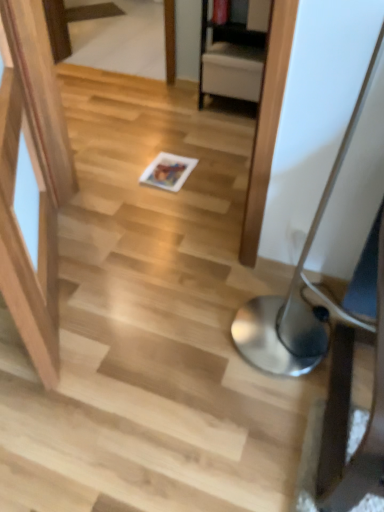
Question: Is silver metallic table lamp at lower right wider than white glossy magazine at center?

Choices:
 (A) yes
 (B) no

Answer: (A)

Question: Is silver metallic table lamp at lower right outside of white glossy magazine at center?

Choices:
 (A) yes
 (B) no

Answer: (A)

Question: Does silver metallic table lamp at lower right contain white glossy magazine at center?

Choices:
 (A) yes
 (B) no

Answer: (B)

Question: From a real-world perspective, is silver metallic table lamp at lower right below white glossy magazine at center?

Choices:
 (A) yes
 (B) no

Answer: (B)

Question: Considering the relative positions of silver metallic table lamp at lower right and white glossy magazine at center in the image provided, is silver metallic table lamp at lower right to the left of white glossy magazine at center from the viewer's perspective?

Choices:
 (A) yes
 (B) no

Answer: (B)

Question: Can you confirm if silver metallic table lamp at lower right is positioned to the right of white glossy magazine at center?

Choices:
 (A) no
 (B) yes

Answer: (B)

Question: Can you confirm if white glossy magazine at center is positioned to the left of silver metallic table lamp at lower right?

Choices:
 (A) no
 (B) yes

Answer: (B)

Question: Does white glossy magazine at center have a greater height compared to silver metallic table lamp at lower right?

Choices:
 (A) yes
 (B) no

Answer: (B)

Question: From the image's perspective, would you say white glossy magazine at center is positioned over silver metallic table lamp at lower right?

Choices:
 (A) yes
 (B) no

Answer: (A)

Question: Is white glossy magazine at center bigger than silver metallic table lamp at lower right?

Choices:
 (A) yes
 (B) no

Answer: (B)

Question: Does white glossy magazine at center have a greater width compared to silver metallic table lamp at lower right?

Choices:
 (A) no
 (B) yes

Answer: (A)

Question: Does white glossy magazine at center appear on the right side of silver metallic table lamp at lower right?

Choices:
 (A) yes
 (B) no

Answer: (B)

Question: From a real-world perspective, relative to white glossy magazine at center, is silver metallic table lamp at lower right vertically above or below?

Choices:
 (A) above
 (B) below

Answer: (A)